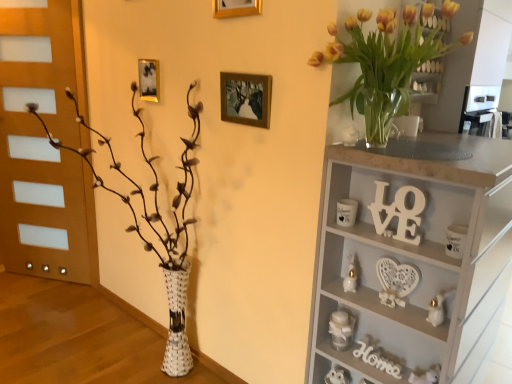
Question: From a real-world perspective, is white woven vase at left positioned above or below gold metallic picture frame at upper center, which is the 2th picture frame from top to bottom?

Choices:
 (A) below
 (B) above

Answer: (A)

Question: Considering the positions of point (183, 152) and point (158, 67), is point (183, 152) closer or farther from the camera than point (158, 67)?

Choices:
 (A) farther
 (B) closer

Answer: (B)

Question: Which of these objects is positioned closest to the wooden picture frame at center, which is the second picture frame in back-to-front order?

Choices:
 (A) white woven vase at left
 (B) white wood shelf at upper right
 (C) translucent glass vase at upper right
 (D) gold metallic picture frame at upper center, which ranks as the 1th picture frame in front-to-back order
 (E) white wooden sign at upper right

Answer: (D)

Question: Based on their relative distances, which object is farther from the wooden picture frame at center, acting as the 3th picture frame starting from the left?

Choices:
 (A) translucent glass vase at upper right
 (B) white wood shelf at upper right
 (C) gold metallic picture frame at upper center, which ranks as the 1th picture frame in front-to-back order
 (D) gold metallic picture frame at upper center, the third picture frame positioned from the front
 (E) white wooden sign at upper right

Answer: (B)